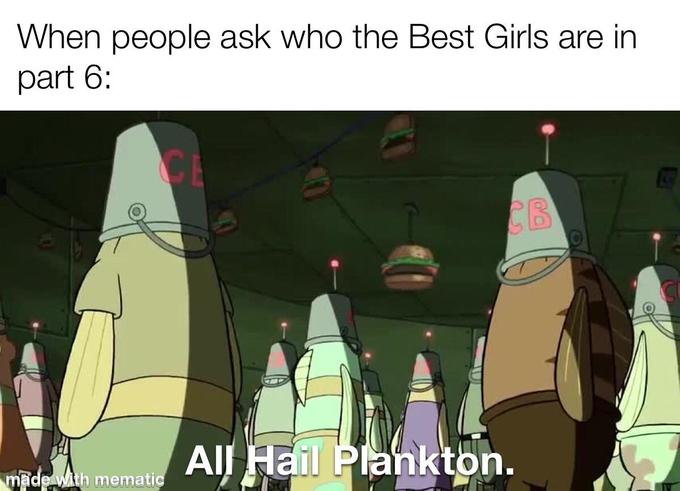
This screenshot has height=491, width=680. I want to click on small circular light, so click(547, 127), click(658, 237), click(335, 264), click(284, 324), click(368, 356), click(428, 335), click(488, 312), click(34, 326).